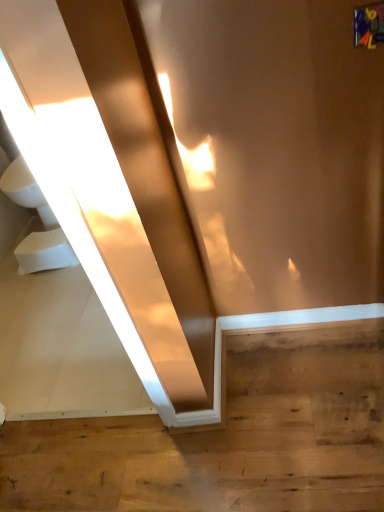
Where is `free space above wooden floor at lower right (from a real-world perspective)`? Image resolution: width=384 pixels, height=512 pixels. free space above wooden floor at lower right (from a real-world perspective) is located at coordinates (168, 422).